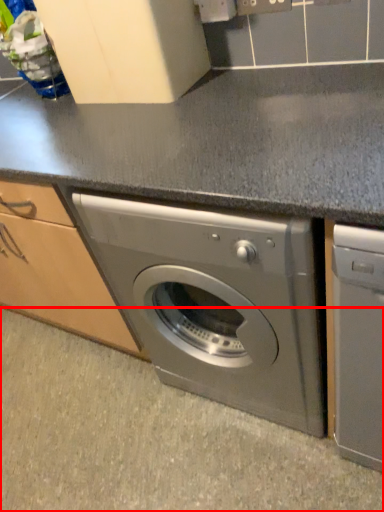
Question: From the image's perspective, where is granite (annotated by the red box) located relative to washing machine?

Choices:
 (A) below
 (B) above

Answer: (A)